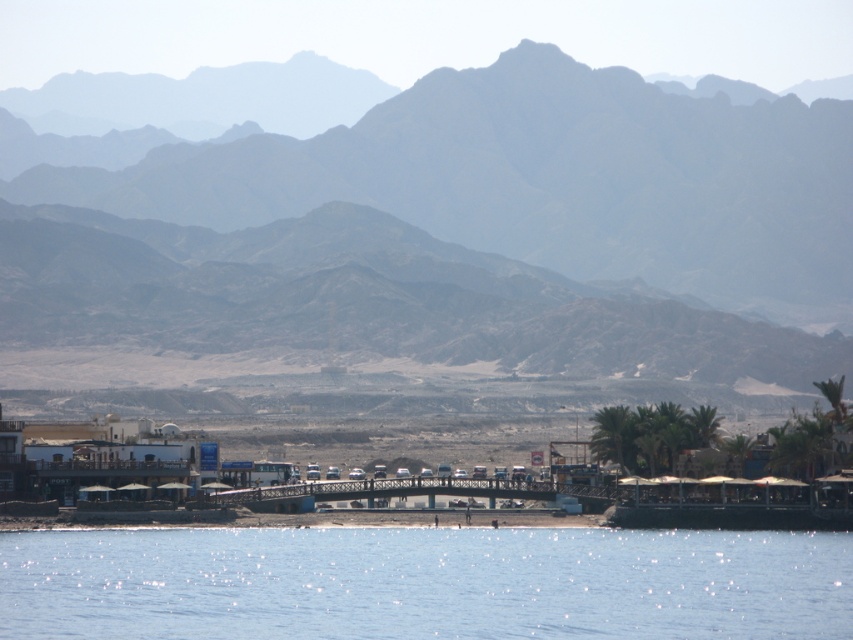
Can you confirm if rocky gray mountains at upper center is positioned to the left of transparent blue water at lower center?

In fact, rocky gray mountains at upper center is to the right of transparent blue water at lower center.

Is rocky gray mountains at upper center positioned before transparent blue water at lower center?

That is False.

Where is `rocky gray mountains at upper center`? This screenshot has height=640, width=853. rocky gray mountains at upper center is located at coordinates (465, 234).

Which is above, rocky gray mountains at upper center or white plastic boat at lower right?

rocky gray mountains at upper center

Is rocky gray mountains at upper center positioned behind white plastic boat at lower right?

Yes, it is behind white plastic boat at lower right.

At what (x,y) coordinates should I click in order to perform the action: click on rocky gray mountains at upper center. Please return your answer as a coordinate pair (x, y). Looking at the image, I should click on (465, 234).

Between transparent blue water at lower center and white plastic boat at lower right, which one appears on the left side from the viewer's perspective?

From the viewer's perspective, transparent blue water at lower center appears more on the left side.

Does point (544, 577) lie behind point (787, 502)?

No, it is in front of (787, 502).

Is point (595, 536) less distant than point (828, 477)?

Yes, point (595, 536) is closer to viewer.

The width and height of the screenshot is (853, 640). I want to click on transparent blue water at lower center, so click(424, 582).